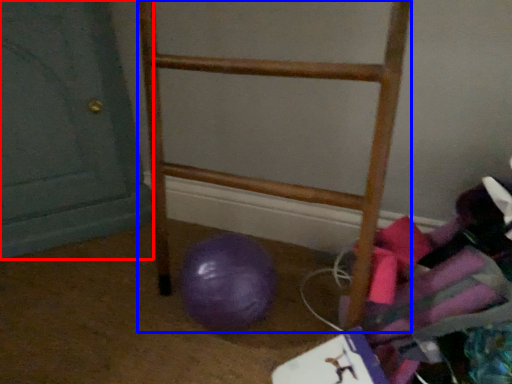
Question: Which object appears closest to the camera in this image, door (highlighted by a red box) or furniture (highlighted by a blue box)?

Choices:
 (A) door
 (B) furniture

Answer: (B)